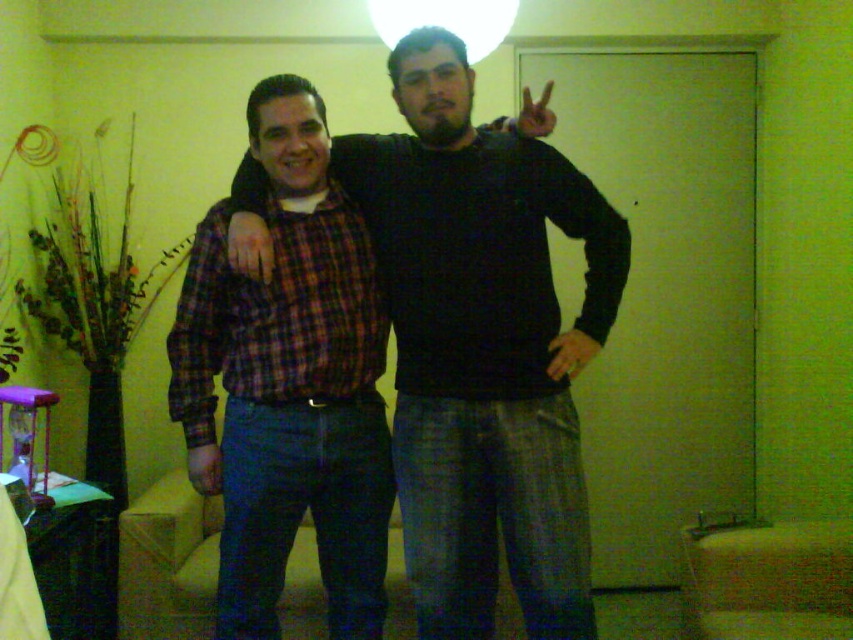
Does point (410, 125) come behind point (466, 22)?

No, it is in front of (466, 22).

Can you confirm if plaid fabric shirt at center is positioned below white matte lampshade at upper center?

Correct, plaid fabric shirt at center is located below white matte lampshade at upper center.

What do you see at coordinates (483, 348) in the screenshot?
I see `plaid fabric shirt at center` at bounding box center [483, 348].

Locate an element on the screen. plaid fabric shirt at center is located at coordinates (483, 348).